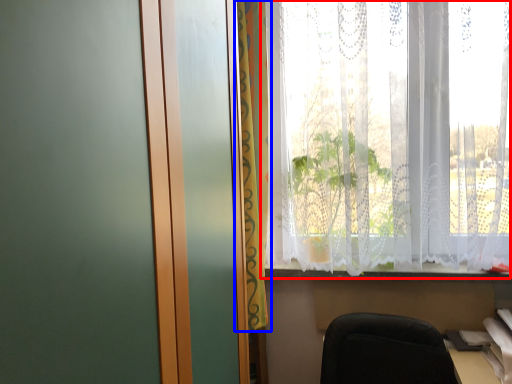
Question: Which of the following is the farthest to the observer, window (highlighted by a red box) or curtain (highlighted by a blue box)?

Choices:
 (A) window
 (B) curtain

Answer: (B)